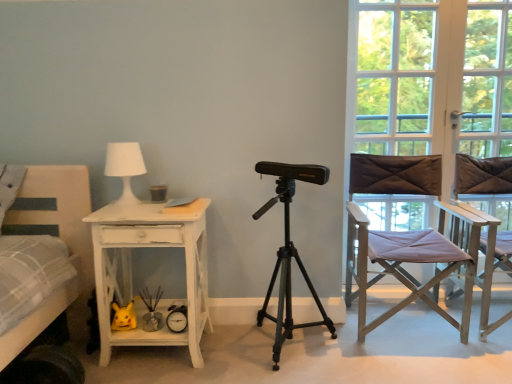
Question: Based on their positions, is light brown wooden chair at right, which ranks as the 1th chair in right-to-left order, located to the left or right of metallic tripod at center?

Choices:
 (A) left
 (B) right

Answer: (B)

Question: Is light brown wooden chair at right, the second chair viewed from the left, wider or thinner than metallic tripod at center?

Choices:
 (A) thin
 (B) wide

Answer: (B)

Question: Considering the real-world distances, which object is farthest from the white matte table lamp at upper left?

Choices:
 (A) metallic tripod at center
 (B) light brown fabric director's chair at right, the first chair from the left
 (C) white distressed wood desk at left
 (D) clear glass window at right
 (E) white glass window frame at right

Answer: (E)

Question: Estimate the real-world distances between objects in this image. Which object is closer to the light brown wooden chair at right, the second chair viewed from the left?

Choices:
 (A) white distressed wood desk at left
 (B) light brown fabric director's chair at right, which is the second chair in right-to-left order
 (C) clear glass window at right
 (D) metallic tripod at center
 (E) white glass window frame at right

Answer: (B)